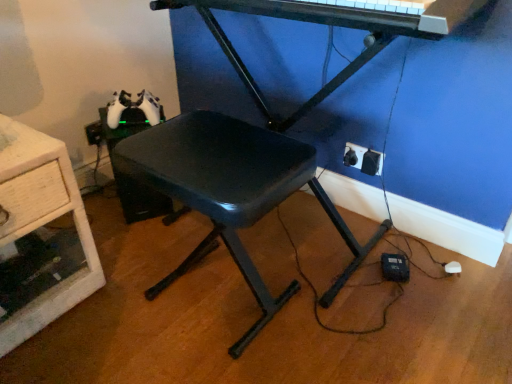
Where is `empty space that is in between wooden drawer at left and black plastic stool at center`? empty space that is in between wooden drawer at left and black plastic stool at center is located at coordinates (122, 306).